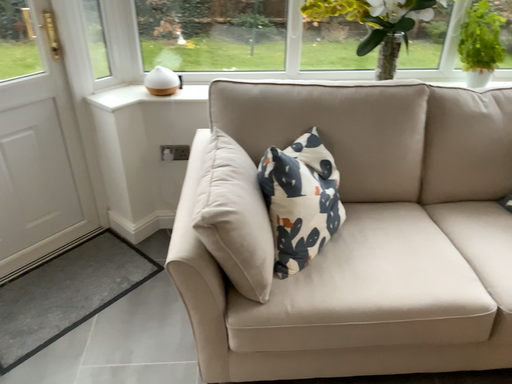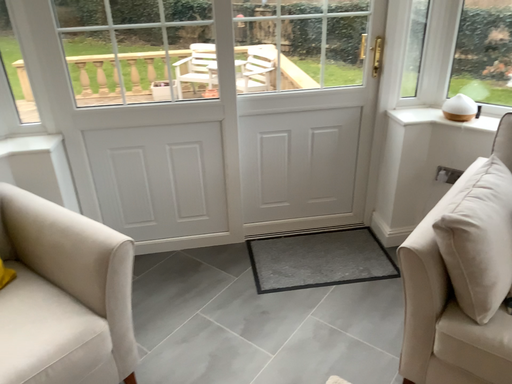
Question: Which way did the camera rotate in the video?

Choices:
 (A) rotated left
 (B) rotated right

Answer: (A)